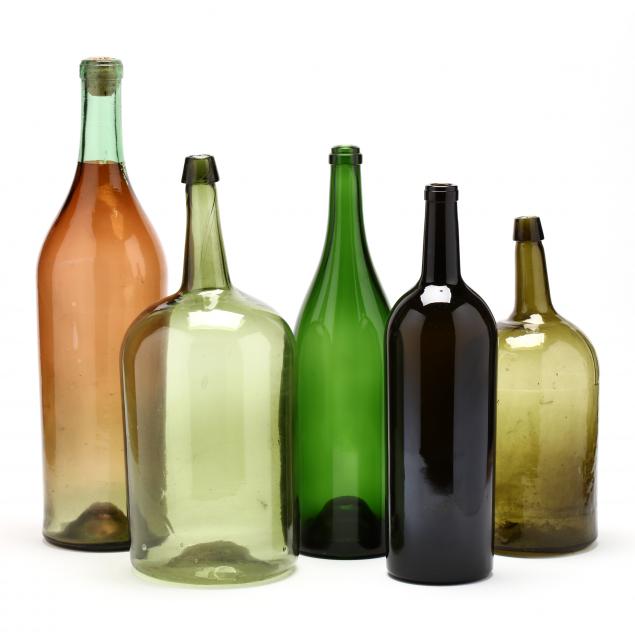
The height and width of the screenshot is (635, 635). Find the location of `glass bottle`. glass bottle is located at coordinates (84, 390), (176, 418), (345, 408), (429, 415), (569, 424).